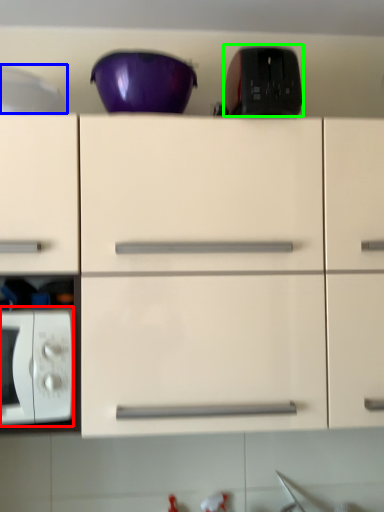
Question: Which object is positioned closest to microwave oven (highlighted by a red box)? Select from appliance (highlighted by a blue box) and appliance (highlighted by a green box).

Choices:
 (A) appliance
 (B) appliance

Answer: (A)